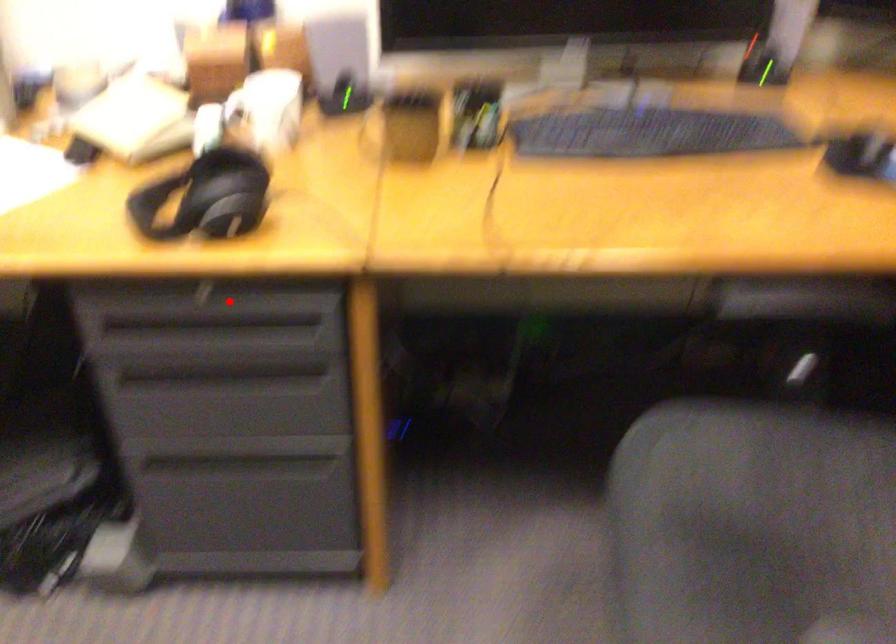
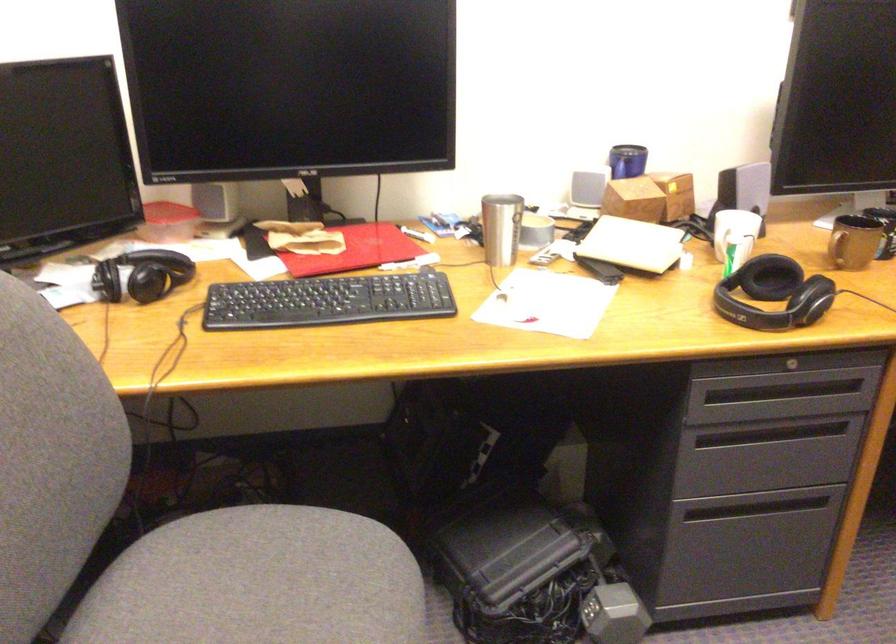
Question: I am providing you with two images of the same scene from different viewpoints. In image1, a red point is highlighted. Considering the same 3D point in image2, which of the following is correct?

Choices:
 (A) It is closer
 (B) It is farther

Answer: (B)